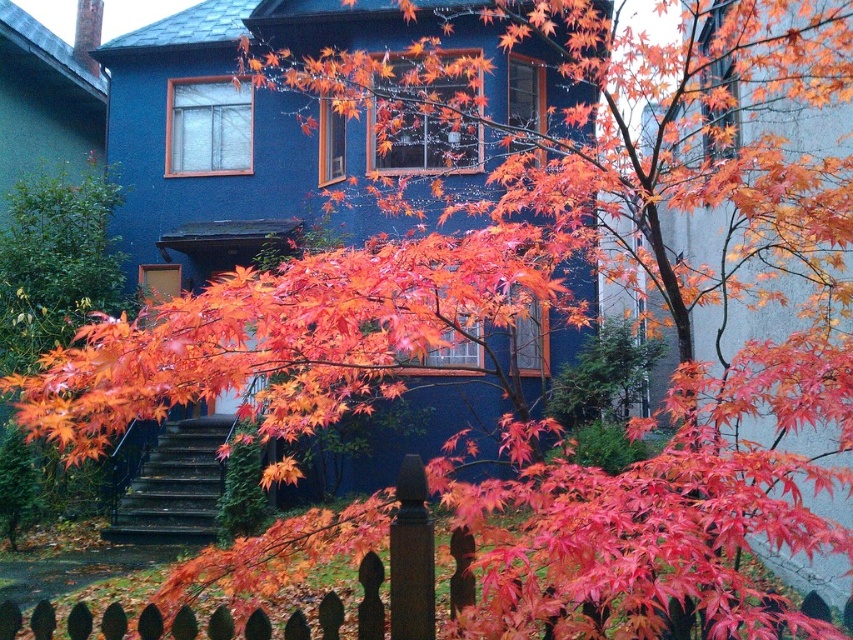
Question: Among these objects, which one is farthest from the camera?

Choices:
 (A) vivid orange maple leaf at center
 (B) wooden picket fence at lower center

Answer: (B)

Question: Which of the following is the closest to the observer?

Choices:
 (A) vivid orange maple leaf at center
 (B) wooden picket fence at lower center

Answer: (A)

Question: Is vivid orange maple leaf at center closer to camera compared to wooden picket fence at lower center?

Choices:
 (A) no
 (B) yes

Answer: (B)

Question: Which point is closer to the camera taking this photo?

Choices:
 (A) (80, 404)
 (B) (850, 628)

Answer: (A)

Question: Is vivid orange maple leaf at center positioned behind wooden picket fence at lower center?

Choices:
 (A) no
 (B) yes

Answer: (A)

Question: Is the position of vivid orange maple leaf at center more distant than that of wooden picket fence at lower center?

Choices:
 (A) no
 (B) yes

Answer: (A)